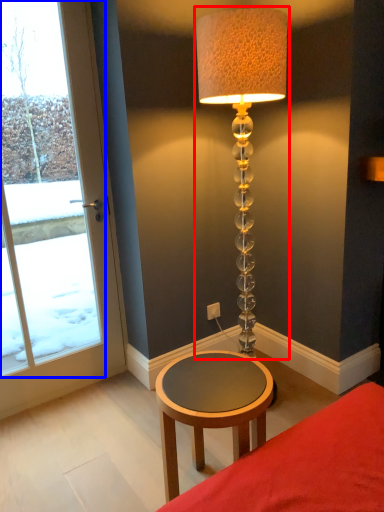
Question: Which of the following is the farthest to the observer, lamp (highlighted by a red box) or window (highlighted by a blue box)?

Choices:
 (A) lamp
 (B) window

Answer: (B)